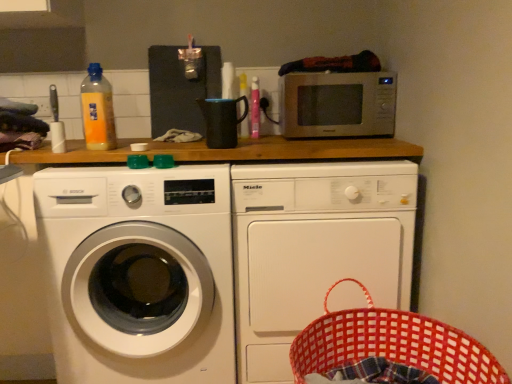
The width and height of the screenshot is (512, 384). I want to click on free space in front of yellow translucent bottle at upper left, which ranks as the 2th bottle in back-to-front order, so click(90, 166).